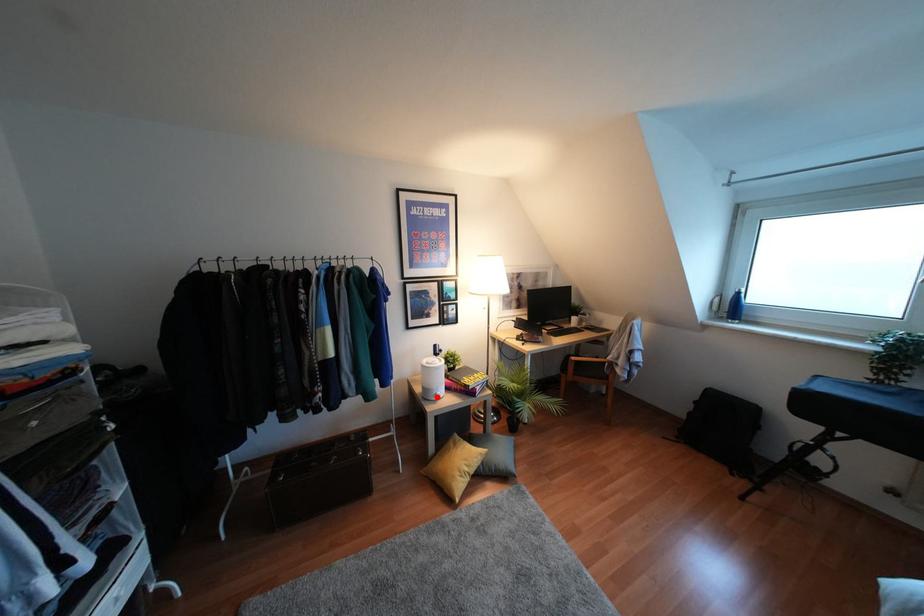
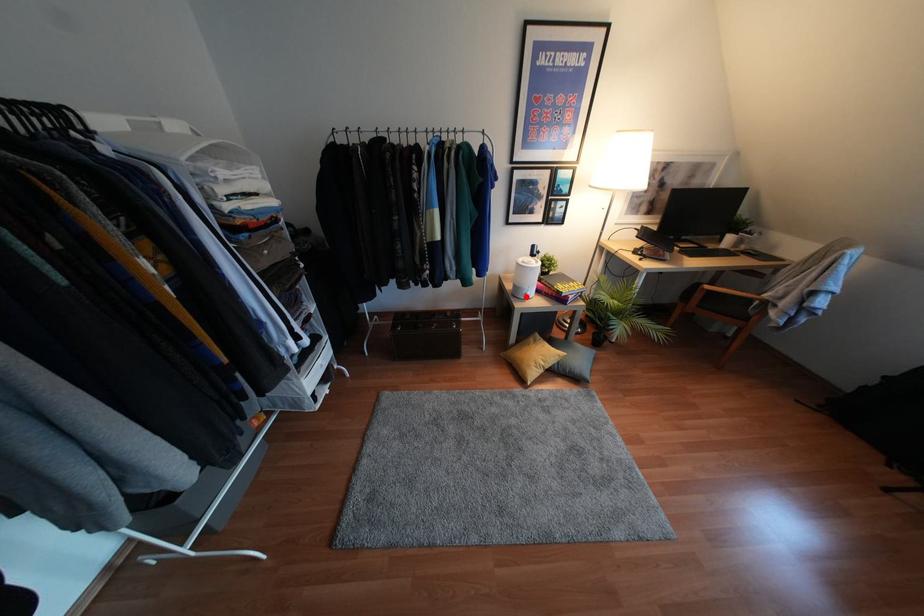
I am providing you with two images of the same scene from different viewpoints. A red point is marked on the first image and another point is marked on the second image. Do the highlighted points in image1 and image2 indicate the same real-world spot?

Yes